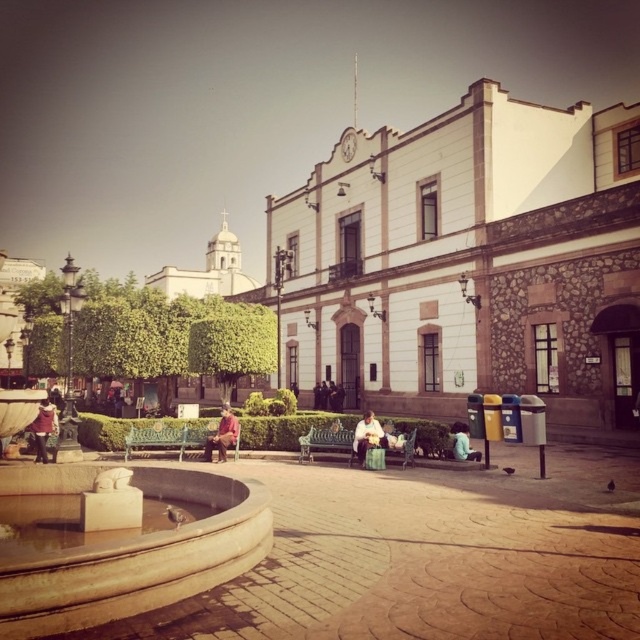
Question: Can you confirm if polished wood bench at center is wider than green painted wood park bench at center?

Choices:
 (A) no
 (B) yes

Answer: (B)

Question: Which object is closer to the camera taking this photo?

Choices:
 (A) green painted wood park bench at center
 (B) beige stone fountain at lower left
 (C) reddish-brown fabric jacket at center

Answer: (B)

Question: Does polished wood bench at center have a lesser width compared to matte red shirt at lower left?

Choices:
 (A) yes
 (B) no

Answer: (A)

Question: Estimate the real-world distances between objects in this image. Which object is closer to the polished wood bench at center?

Choices:
 (A) beige stone fountain at lower left
 (B) light blue shirt at center

Answer: (B)

Question: Considering the relative positions of reddish-brown fabric jacket at center and light blue shirt at center in the image provided, where is reddish-brown fabric jacket at center located with respect to light blue shirt at center?

Choices:
 (A) below
 (B) above

Answer: (A)

Question: Which of the following is the farthest from the observer?

Choices:
 (A) click(x=378, y=444)
 (B) click(x=40, y=449)

Answer: (B)